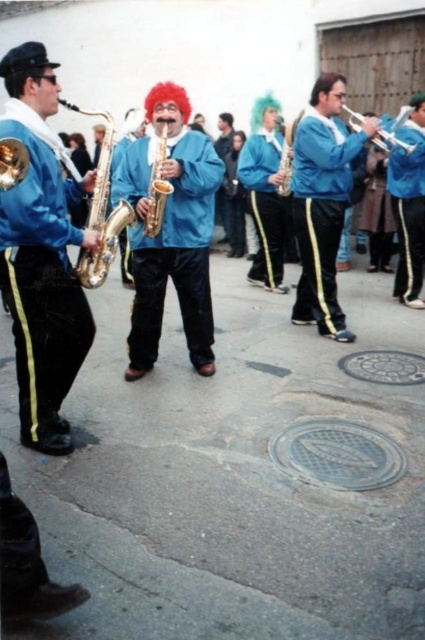
From the picture: You are a photographer at the street performance. You want to take a photo of the band members. The point marked at [172,246] is where the matte blue jacket at center is located. If you position your camera to focus on the matte blue jacket at center, will the red afro wig and mustache of the central figure also be in the frame?

The point marked at [172,246] indicates the location of the matte blue jacket at center. Since the central figure with the red afro wig and mustache is actively engaged in playing their saxophone and is part of the band members, their distinctive costume would naturally be within the camera frame when focusing on the matte blue jacket at center.

Consider the image. You are a photographer trying to capture the central performer wearing the matte blue jacket at center. Based on their position coordinates, where should you aim your camera to ensure the jacket is in the frame?

The matte blue jacket at center is located at point coordinates 0.386 on the x axis and 0.405 on the y axis, so you should aim your camera at those coordinates to capture the jacket in the frame.

You are a photographer trying to capture a clear shot of the matte blue jacket at center and the silver metallic trumpet at center during the street performance. Since you want both objects to appear equally prominent in the photo, which one should you zoom in on more?

The matte blue jacket at center is larger in size than the silver metallic trumpet at center. To make both appear equally prominent, you should zoom in more on the silver metallic trumpet at center to enlarge its image in the photo.